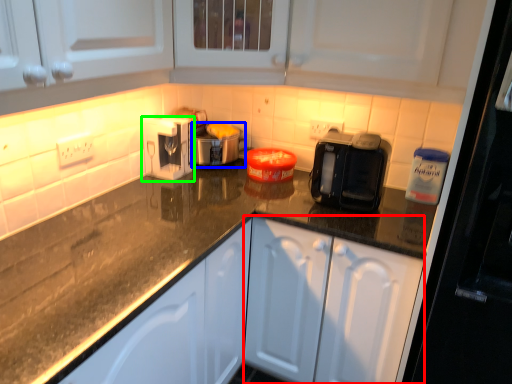
Question: Based on their relative distances, which object is farther from cabinetry (highlighted by a red box)? Choose from appliance (highlighted by a blue box) and kitchen appliance (highlighted by a green box).

Choices:
 (A) appliance
 (B) kitchen appliance

Answer: (B)